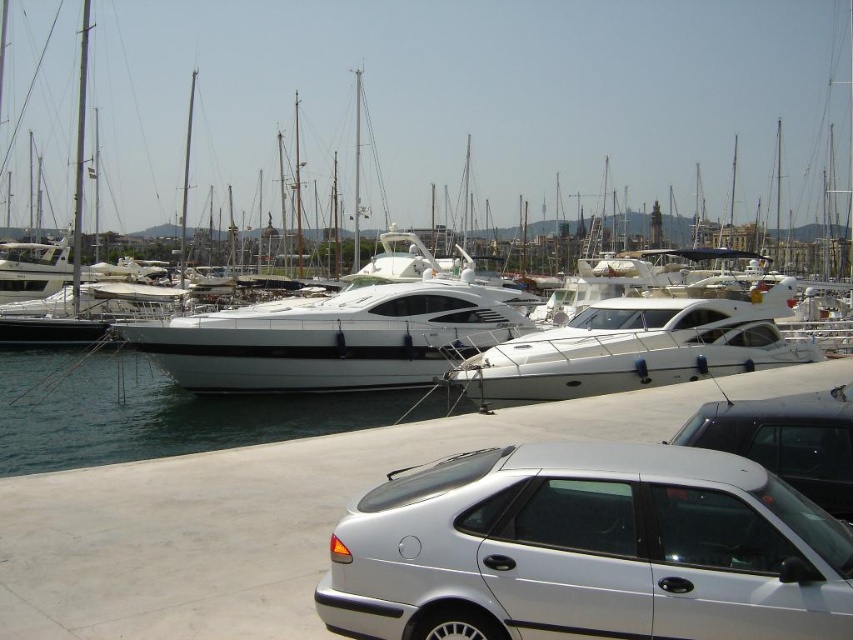
You are standing at the point closest to the cars in the marina scene. There are two points marked in the image, one at coordinates point (607, 108) and the other at point (815, 556). Which point is farther away from you?

Point (607, 108) is behind point (815, 556), so the point farther away from you is point (607, 108).

You are standing at the marina and want to take a photo of the silver metallic car at lower right and the white glossy water at center. Which object should you focus on first if you want to capture both in a single frame without adjusting your camera angle?

The silver metallic car at lower right has a lesser height compared to white glossy water at center, so you should focus on the silver metallic car at lower right first to ensure it is fully captured in the frame before the taller white glossy water at center might block it.